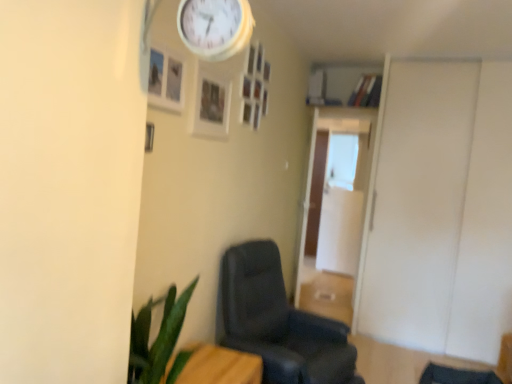
What do you see at coordinates (341, 208) in the screenshot? The image size is (512, 384). I see `transparent glass door at center, the 1th glass door when ordered from back to front` at bounding box center [341, 208].

Where is `transparent glass door at center, the 1th glass door when ordered from back to front`? The height and width of the screenshot is (384, 512). transparent glass door at center, the 1th glass door when ordered from back to front is located at coordinates (341, 208).

What is the approximate width of wooden table at lower left?

The width of wooden table at lower left is 15.89 inches.

This screenshot has height=384, width=512. Describe the element at coordinates (338, 222) in the screenshot. I see `transparent glass door at center, which appears as the first glass door when viewed from the front` at that location.

Image resolution: width=512 pixels, height=384 pixels. What do you see at coordinates (278, 322) in the screenshot?
I see `matte black chair at center` at bounding box center [278, 322].

Where is `white wooden clock at upper center`? white wooden clock at upper center is located at coordinates (215, 27).

Considering the positions of objects matte black chair at center and wooden table at lower left in the image provided, who is more to the left, matte black chair at center or wooden table at lower left?

wooden table at lower left.

Considering the positions of point (221, 321) and point (168, 364), is point (221, 321) closer or farther from the camera than point (168, 364)?

Point (221, 321).

Based on the photo, is matte black chair at center facing away from wooden table at lower left?

A: matte black chair at center does not have its back to wooden table at lower left.

From the image's perspective, is matte black chair at center above or below wooden table at lower left?

matte black chair at center is above wooden table at lower left.

Between point (440, 104) and point (343, 350), which one is positioned in front?

The point (343, 350) is more forward.

Which of these two, white matte door at right or matte black chair at center, is smaller?

Smaller between the two is matte black chair at center.

What's the angular difference between white matte door at right and matte black chair at center's facing directions?

They differ by 77.2 degrees in their facing directions.

From the image's perspective, which is below, white matte door at right or matte black chair at center?

matte black chair at center appears lower in the image.

What's the angular difference between white matte door at right and transparent glass door at center, the 1th glass door when ordered from back to front,'s facing directions?

8.15 degrees.

Is white matte door at right facing away from transparent glass door at center, the 2th glass door from the front?

white matte door at right is not turned away from transparent glass door at center, the 2th glass door from the front.

Can you confirm if white matte door at right is positioned to the left of transparent glass door at center, the 2th glass door from the front?

Incorrect, white matte door at right is not on the left side of transparent glass door at center, the 2th glass door from the front.

Which object is thinner, white matte door at right or transparent glass door at center, the 2th glass door from the front?

transparent glass door at center, the 2th glass door from the front, is thinner.

Is transparent glass door at center, which appears as the first glass door when viewed from the front, wider than transparent glass door at center, the 2th glass door from the front?

In fact, transparent glass door at center, which appears as the first glass door when viewed from the front, might be narrower than transparent glass door at center, the 2th glass door from the front.

Considering the sizes of objects transparent glass door at center, which ranks as the second glass door in back-to-front order, and transparent glass door at center, the 2th glass door from the front, in the image provided, who is smaller, transparent glass door at center, which ranks as the second glass door in back-to-front order, or transparent glass door at center, the 2th glass door from the front,?

transparent glass door at center, which ranks as the second glass door in back-to-front order, is smaller.

Is transparent glass door at center, which appears as the first glass door when viewed from the front, next to transparent glass door at center, the 2th glass door from the front, and touching it?

No, transparent glass door at center, which appears as the first glass door when viewed from the front, is not with transparent glass door at center, the 2th glass door from the front.

From a real-world perspective, is transparent glass door at center, which ranks as the second glass door in back-to-front order, beneath transparent glass door at center, the 1th glass door when ordered from back to front?

Yes, from a real-world perspective, transparent glass door at center, which ranks as the second glass door in back-to-front order, is under transparent glass door at center, the 1th glass door when ordered from back to front.

Is white matte door at right wider than white wooden clock at upper center?

Correct, the width of white matte door at right exceeds that of white wooden clock at upper center.

Would you consider white matte door at right to be distant from white wooden clock at upper center?

white matte door at right is far away from white wooden clock at upper center.

Which of these two, white matte door at right or white wooden clock at upper center, is bigger?

white matte door at right.

Does wooden table at lower left have a lesser width compared to matte black chair at center?

Indeed, wooden table at lower left has a lesser width compared to matte black chair at center.

Is there a large distance between wooden table at lower left and matte black chair at center?

They are positioned close to each other.

Is wooden table at lower left in front of or behind white matte door at right in the image?

wooden table at lower left is in front of white matte door at right.

From the image's perspective, is wooden table at lower left positioned above or below white matte door at right?

Based on their image positions, wooden table at lower left is located beneath white matte door at right.

Are wooden table at lower left and white matte door at right located far from each other?

wooden table at lower left is far away from white matte door at right.

Is wooden table at lower left wider than white matte door at right?

No, wooden table at lower left is not wider than white matte door at right.

Identify the location of chair that is on the right side of wooden table at lower left. Image resolution: width=512 pixels, height=384 pixels. (278, 322).

Locate an element on the screen. This screenshot has width=512, height=384. door that is above the matte black chair at center (from a real-world perspective) is located at coordinates (418, 203).

Which object lies nearer to the anchor point white wooden clock at upper center, matte black chair at center or white matte door at right?

matte black chair at center is closer to white wooden clock at upper center.

Considering their positions, is transparent glass door at center, which ranks as the second glass door in back-to-front order, positioned closer to wooden table at lower left than transparent glass door at center, the 2th glass door from the front?

Among the two, transparent glass door at center, which ranks as the second glass door in back-to-front order, is located nearer to wooden table at lower left.

Based on the photo, when comparing their distances from transparent glass door at center, the 2th glass door from the front, does transparent glass door at center, which ranks as the second glass door in back-to-front order, or matte black chair at center seem further?

matte black chair at center is positioned further to the anchor transparent glass door at center, the 2th glass door from the front.

Which object lies further to the anchor point white matte door at right, wooden table at lower left or transparent glass door at center, the 1th glass door when ordered from back to front?

wooden table at lower left.

Considering their positions, is white matte door at right positioned further to white wooden clock at upper center than matte black chair at center?

The object further to white wooden clock at upper center is white matte door at right.

From the image, which object appears to be nearer to white wooden clock at upper center, wooden table at lower left or matte black chair at center?

wooden table at lower left lies closer to white wooden clock at upper center than the other object.

Considering their positions, is transparent glass door at center, the 1th glass door when ordered from back to front, positioned closer to wooden table at lower left than white wooden clock at upper center?

The object closer to wooden table at lower left is white wooden clock at upper center.

When comparing their distances from matte black chair at center, does white matte door at right or transparent glass door at center, which ranks as the second glass door in back-to-front order, seem closer?

white matte door at right is positioned closer to the anchor matte black chair at center.

You are a GUI agent. You are given a task and a screenshot of the screen. Output one action in this format:
    pyautogui.click(x=<x>, y=<y>)
    Task: Click on the chair between white wooden clock at upper center and white matte door at right in the front-back direction
    
    Given the screenshot: What is the action you would take?
    pyautogui.click(x=278, y=322)

At what (x,y) coordinates should I click in order to perform the action: click on door between white wooden clock at upper center and transparent glass door at center, the 1th glass door when ordered from back to front, from front to back. Please return your answer as a coordinate pair (x, y). Looking at the image, I should click on (418, 203).

Find the location of a particular element. door between white wooden clock at upper center and transparent glass door at center, which ranks as the second glass door in back-to-front order, in the front-back direction is located at coordinates (418, 203).

Image resolution: width=512 pixels, height=384 pixels. I want to click on chair located between white wooden clock at upper center and transparent glass door at center, which ranks as the second glass door in back-to-front order, in the depth direction, so click(x=278, y=322).